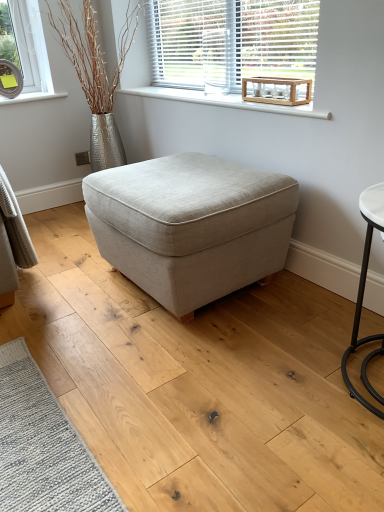
Question: In terms of size, does white smooth window sill at upper center appear bigger or smaller than clear glass round table at upper right?

Choices:
 (A) big
 (B) small

Answer: (A)

Question: Is white smooth window sill at upper center inside or outside of clear glass round table at upper right?

Choices:
 (A) inside
 (B) outside

Answer: (B)

Question: Based on their relative distances, which object is nearer to the beige fabric ottoman at center?

Choices:
 (A) white smooth window sill at upper center
 (B) wooden crate at upper center
 (C) clear glass round table at upper right

Answer: (A)

Question: Which is farther from the wooden crate at upper center?

Choices:
 (A) white smooth window sill at upper center
 (B) beige fabric ottoman at center
 (C) clear glass round table at upper right

Answer: (B)